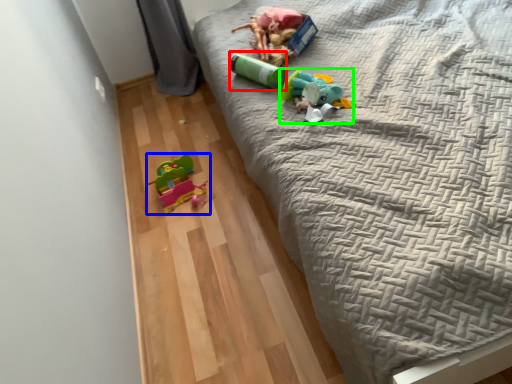
Question: Considering the real-world distances, which object is closest to toy (highlighted by a red box)? toy (highlighted by a blue box) or toy (highlighted by a green box).

Choices:
 (A) toy
 (B) toy

Answer: (B)